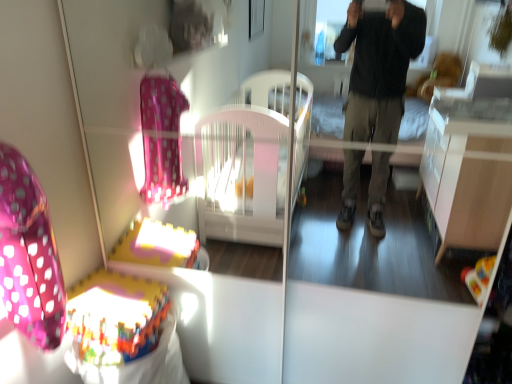
The width and height of the screenshot is (512, 384). What do you see at coordinates (120, 330) in the screenshot?
I see `multicolored plastic baby carriage at lower left` at bounding box center [120, 330].

Locate an element on the screen. The height and width of the screenshot is (384, 512). multicolored plastic baby carriage at lower left is located at coordinates [120, 330].

What do you see at coordinates (29, 254) in the screenshot?
I see `pink polka dot fabric swivel chair at left` at bounding box center [29, 254].

Measure the distance between pink polka dot fabric swivel chair at left and camera.

The depth of pink polka dot fabric swivel chair at left is 38.93 inches.

At what (x,y) coordinates should I click in order to perform the action: click on pink polka dot fabric swivel chair at left. Please return your answer as a coordinate pair (x, y). The width and height of the screenshot is (512, 384). Looking at the image, I should click on (29, 254).

What is the approximate width of pink polka dot fabric swivel chair at left?

7.51 inches.

Where is `multicolored plastic baby carriage at lower left`? multicolored plastic baby carriage at lower left is located at coordinates (120, 330).

Which is more to the right, multicolored plastic baby carriage at lower left or pink polka dot fabric swivel chair at left?

Positioned to the right is multicolored plastic baby carriage at lower left.

Is the position of multicolored plastic baby carriage at lower left less distant than that of pink polka dot fabric swivel chair at left?

No, multicolored plastic baby carriage at lower left is further to the viewer.

Is point (147, 248) behind point (42, 308)?

Yes, point (147, 248) is farther from viewer.

From the image's perspective, is multicolored plastic baby carriage at lower left on pink polka dot fabric swivel chair at left?

No.

From a real-world perspective, which is physically above, multicolored plastic baby carriage at lower left or pink polka dot fabric swivel chair at left?

From a 3D spatial view, pink polka dot fabric swivel chair at left is above.

Between multicolored plastic baby carriage at lower left and pink polka dot fabric swivel chair at left, which one has smaller width?

Thinner between the two is pink polka dot fabric swivel chair at left.

Between multicolored plastic baby carriage at lower left and pink polka dot fabric swivel chair at left, which one has less height?

With less height is multicolored plastic baby carriage at lower left.

Does multicolored plastic baby carriage at lower left have a larger size compared to pink polka dot fabric swivel chair at left?

Correct, multicolored plastic baby carriage at lower left is larger in size than pink polka dot fabric swivel chair at left.

Could pink polka dot fabric swivel chair at left be considered to be inside multicolored plastic baby carriage at lower left?

No, pink polka dot fabric swivel chair at left is not inside multicolored plastic baby carriage at lower left.

Are multicolored plastic baby carriage at lower left and pink polka dot fabric swivel chair at left far apart?

No, multicolored plastic baby carriage at lower left is not far away from pink polka dot fabric swivel chair at left.

Could you tell me if multicolored plastic baby carriage at lower left is facing pink polka dot fabric swivel chair at left?

No, multicolored plastic baby carriage at lower left is not oriented towards pink polka dot fabric swivel chair at left.

This screenshot has height=384, width=512. I want to click on swivel chair above the multicolored plastic baby carriage at lower left (from the image's perspective), so click(x=29, y=254).

Is pink polka dot fabric swivel chair at left to the left of multicolored plastic baby carriage at lower left from the viewer's perspective?

Yes, pink polka dot fabric swivel chair at left is to the left of multicolored plastic baby carriage at lower left.

In the scene shown: Is the depth of pink polka dot fabric swivel chair at left less than that of multicolored plastic baby carriage at lower left?

Yes.

Which is less distant, (18, 167) or (128, 297)?

Point (18, 167)

From the image's perspective, is pink polka dot fabric swivel chair at left under multicolored plastic baby carriage at lower left?

Incorrect, from the image's perspective, pink polka dot fabric swivel chair at left is higher than multicolored plastic baby carriage at lower left.

From a real-world perspective, is pink polka dot fabric swivel chair at left above or below multicolored plastic baby carriage at lower left?

Clearly, from a real-world perspective, pink polka dot fabric swivel chair at left is above multicolored plastic baby carriage at lower left.

Which of these two, pink polka dot fabric swivel chair at left or multicolored plastic baby carriage at lower left, is wider?

With larger width is multicolored plastic baby carriage at lower left.

Is pink polka dot fabric swivel chair at left taller or shorter than multicolored plastic baby carriage at lower left?

In the image, pink polka dot fabric swivel chair at left appears to be taller than multicolored plastic baby carriage at lower left.

Is pink polka dot fabric swivel chair at left smaller than multicolored plastic baby carriage at lower left?

Indeed, pink polka dot fabric swivel chair at left has a smaller size compared to multicolored plastic baby carriage at lower left.

Would you say pink polka dot fabric swivel chair at left is outside multicolored plastic baby carriage at lower left?

Yes, pink polka dot fabric swivel chair at left is located beyond the bounds of multicolored plastic baby carriage at lower left.

Looking at this image, is pink polka dot fabric swivel chair at left far from multicolored plastic baby carriage at lower left?

That's not correct — pink polka dot fabric swivel chair at left is a little close to multicolored plastic baby carriage at lower left.

Is pink polka dot fabric swivel chair at left turned away from multicolored plastic baby carriage at lower left?

That's not correct — pink polka dot fabric swivel chair at left is not looking away from multicolored plastic baby carriage at lower left.

You are a GUI agent. You are given a task and a screenshot of the screen. Output one action in this format:
    pyautogui.click(x=<x>, y=<y>)
    Task: Click on the baby carriage that is behind the pink polka dot fabric swivel chair at left
    The image size is (512, 384).
    Given the screenshot: What is the action you would take?
    pyautogui.click(x=120, y=330)

Find the location of a particular element. Image resolution: width=512 pixels, height=384 pixels. swivel chair that appears above the multicolored plastic baby carriage at lower left (from the image's perspective) is located at coordinates (29, 254).

Identify the location of baby carriage below the pink polka dot fabric swivel chair at left (from the image's perspective). (120, 330).